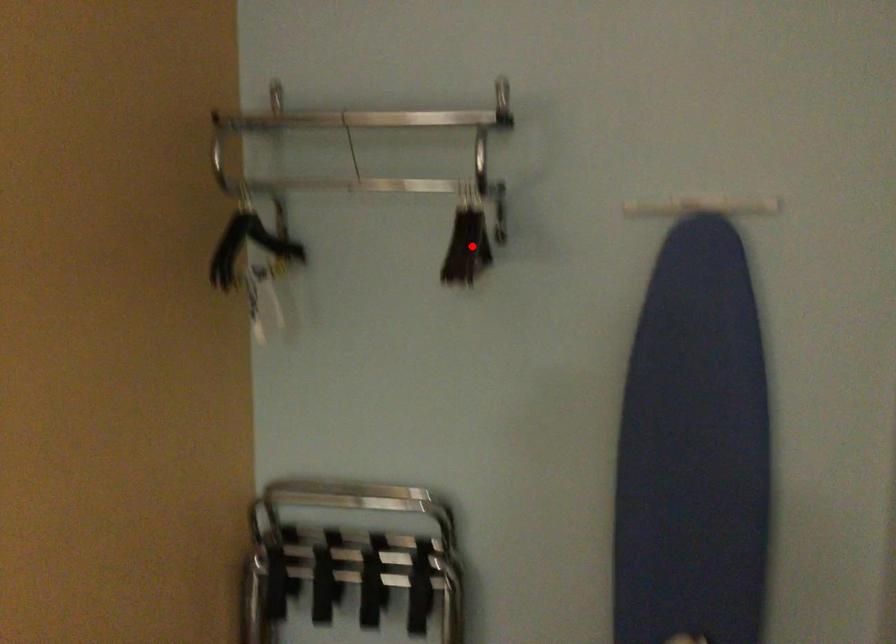
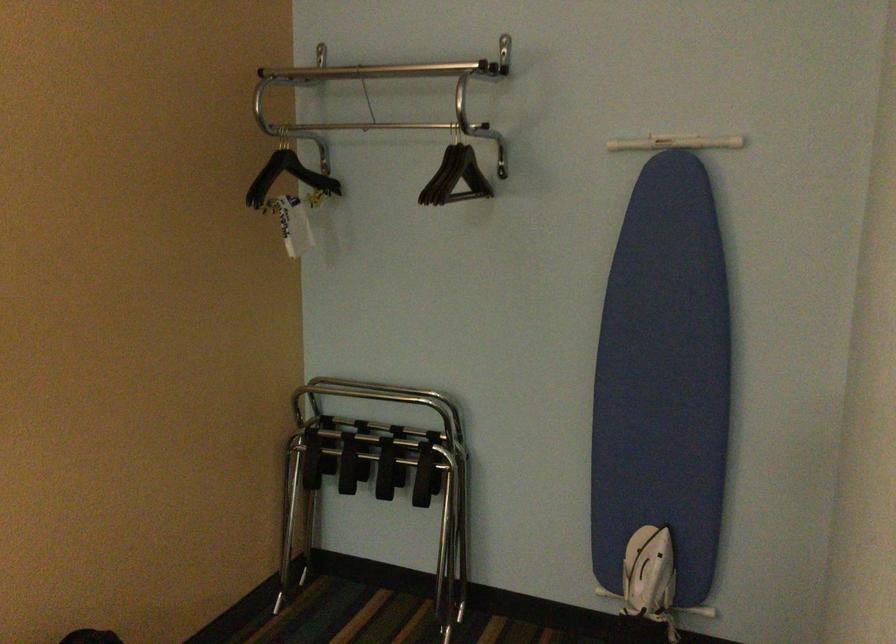
Where in the second image is the point corresponding to the highlighted location from the first image?

(455, 176)